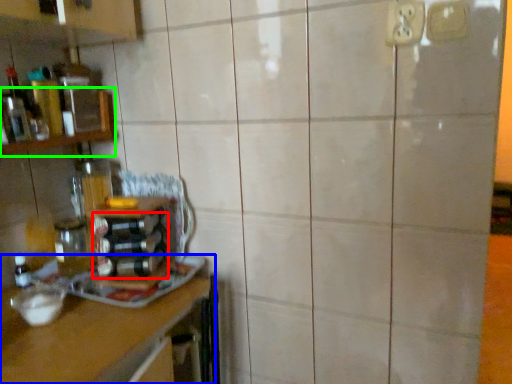
Question: Estimate the real-world distances between objects in this image. Which object is closer to bottle (highlighted by a red box), countertop (highlighted by a blue box) or shelf (highlighted by a green box)?

Choices:
 (A) countertop
 (B) shelf

Answer: (A)